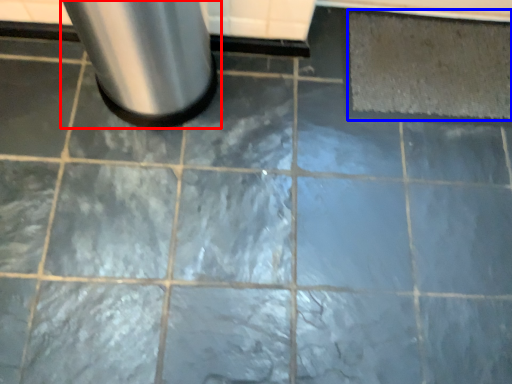
Question: Which object appears closest to the camera in this image, waste container (highlighted by a red box) or mat (highlighted by a blue box)?

Choices:
 (A) waste container
 (B) mat

Answer: (A)